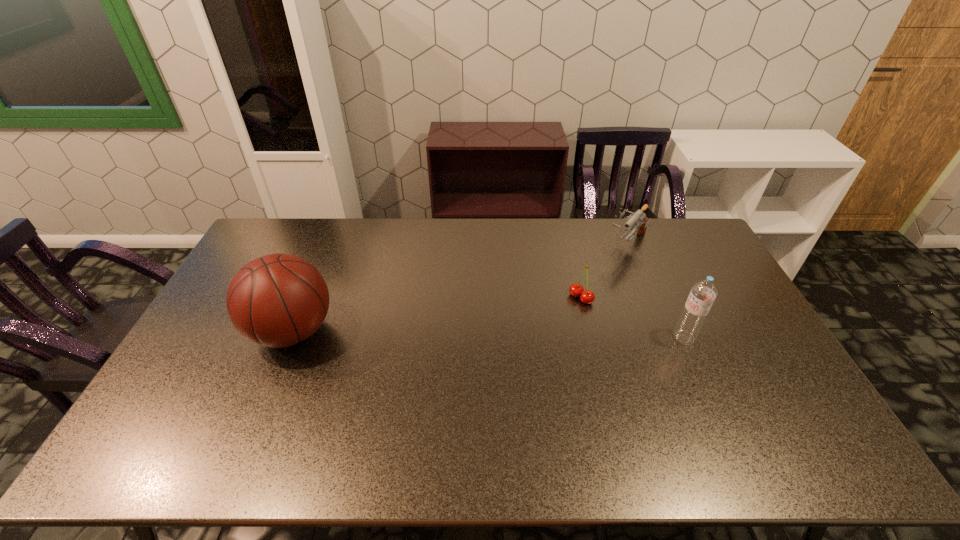
The width and height of the screenshot is (960, 540). What are the coordinates of `free region located 0.060m with the stems of the shortest object pointing upwards` in the screenshot? It's located at (563, 314).

Where is `free space located 0.370m at the barrel end of the farthest object`? Image resolution: width=960 pixels, height=540 pixels. free space located 0.370m at the barrel end of the farthest object is located at coordinates (564, 314).

Locate an element on the screen. The height and width of the screenshot is (540, 960). vacant position located 0.070m at the barrel end of the farthest object is located at coordinates (608, 266).

This screenshot has height=540, width=960. In order to click on free space located 0.120m at the barrel end of the farthest object in this screenshot , I will do `click(601, 274)`.

What are the coordinates of `object present at the far edge` in the screenshot? It's located at (638, 218).

This screenshot has height=540, width=960. What are the coordinates of `object situated at the left edge` in the screenshot? It's located at (278, 300).

Identify the location of vacant area at the far edge of the desktop. (435, 241).

Identify the location of vacant space at the right edge of the desktop. Image resolution: width=960 pixels, height=540 pixels. (689, 257).

You are a GUI agent. You are given a task and a screenshot of the screen. Output one action in this format:
    pyautogui.click(x=<x>, y=<y>)
    Task: Click on the free space at the far left corner of the desktop
    Image resolution: width=960 pixels, height=540 pixels.
    Given the screenshot: What is the action you would take?
    pyautogui.click(x=282, y=225)

Identify the location of free point between the shortest object and the water bottle. (633, 318).